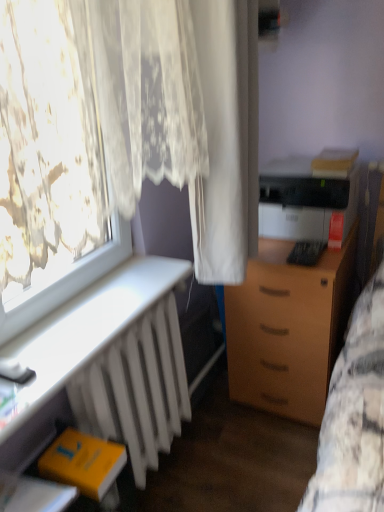
The width and height of the screenshot is (384, 512). What do you see at coordinates (106, 366) in the screenshot?
I see `white matte radiator at lower left` at bounding box center [106, 366].

In order to face white matte radiator at lower left, should I rotate leftwards or rightwards?

Turn left approximately 14.027 degrees to face it.

What do you see at coordinates (227, 140) in the screenshot? Image resolution: width=384 pixels, height=512 pixels. I see `white sheer curtain at center` at bounding box center [227, 140].

The image size is (384, 512). I want to click on white matte radiator at lower left, so click(x=106, y=366).

Considering the positions of objects yellow matte book at lower left and white sheer curtain at center in the image provided, who is in front, yellow matte book at lower left or white sheer curtain at center?

white sheer curtain at center is in front.

In the image, there is a yellow matte book at lower left. Where is `curtain above it (from the image's perspective)`? This screenshot has height=512, width=384. curtain above it (from the image's perspective) is located at coordinates (227, 140).

Can white sheer curtain at center be found inside yellow matte book at lower left?

Actually, white sheer curtain at center is outside yellow matte book at lower left.

From the image's perspective, between yellow matte book at lower left and white sheer curtain at center, who is located below?

yellow matte book at lower left, from the image's perspective.

Who is shorter, wooden drawer at center-right or yellow matte book at lower left?

Standing shorter between the two is yellow matte book at lower left.

Consider the image. Does wooden drawer at center-right have a greater width compared to yellow matte book at lower left?

Yes, wooden drawer at center-right is wider than yellow matte book at lower left.

Is wooden drawer at center-right behind white sheer curtain at center?

Yes, wooden drawer at center-right is further from the viewer.

Considering the sizes of objects wooden drawer at center-right and white sheer curtain at center in the image provided, who is wider, wooden drawer at center-right or white sheer curtain at center?

With larger width is wooden drawer at center-right.

The image size is (384, 512). I want to click on drawer located behind the white sheer curtain at center, so click(281, 339).

Considering the sizes of objects white sheer curtain at center and white matte radiator at lower left in the image provided, who is smaller, white sheer curtain at center or white matte radiator at lower left?

With smaller size is white matte radiator at lower left.

Would you say white sheer curtain at center is inside or outside white matte radiator at lower left?

white sheer curtain at center is located beyond the bounds of white matte radiator at lower left.

Considering the positions of objects white sheer curtain at center and white matte radiator at lower left in the image provided, who is more to the left, white sheer curtain at center or white matte radiator at lower left?

white matte radiator at lower left is more to the left.

Would you consider white sheer curtain at center to be distant from white matte radiator at lower left?

That's not correct — white sheer curtain at center is a little close to white matte radiator at lower left.

In the scene shown: Is yellow matte book at lower left looking in the opposite direction of wooden drawer at center-right?

yellow matte book at lower left is not turned away from wooden drawer at center-right.

From a real-world perspective, between yellow matte book at lower left and wooden drawer at center-right, who is vertically lower?

wooden drawer at center-right, from a real-world perspective.

Is yellow matte book at lower left with wooden drawer at center-right?

yellow matte book at lower left is not next to wooden drawer at center-right, and they're not touching.

Measure the distance between yellow matte book at lower left and wooden drawer at center-right.

The distance of yellow matte book at lower left from wooden drawer at center-right is 31.60 inches.

Which is correct: yellow matte book at lower left is inside white matte radiator at lower left, or outside of it?

The correct answer is: outside.

Is yellow matte book at lower left thinner than white matte radiator at lower left?

Yes, yellow matte book at lower left is thinner than white matte radiator at lower left.

Looking at this image, does yellow matte book at lower left have a larger size compared to white matte radiator at lower left?

No, yellow matte book at lower left is not bigger than white matte radiator at lower left.

Is yellow matte book at lower left directly adjacent to white matte radiator at lower left?

yellow matte book at lower left is not next to white matte radiator at lower left, and they're not touching.

Looking at this image, would you say white sheer curtain at center is outside wooden drawer at center-right?

Yes, white sheer curtain at center is located beyond the bounds of wooden drawer at center-right.

How many degrees apart are the facing directions of white sheer curtain at center and wooden drawer at center-right?

There is a 89.7-degree angle between the facing directions of white sheer curtain at center and wooden drawer at center-right.

Which is in front, point (256, 188) or point (314, 357)?

The point (256, 188) is in front.

Which of these two, white sheer curtain at center or wooden drawer at center-right, is wider?

wooden drawer at center-right is wider.

Find the location of a particular element. book on the left of white sheer curtain at center is located at coordinates (85, 465).

The image size is (384, 512). Find the location of `drawer that appears on the right of yellow matte book at lower left`. drawer that appears on the right of yellow matte book at lower left is located at coordinates (281, 339).

From the image, which object appears to be nearer to yellow matte book at lower left, white sheer curtain at center or wooden drawer at center-right?

white sheer curtain at center.

Estimate the real-world distances between objects in this image. Which object is further from white matte radiator at lower left, black plastic printer at right or yellow matte book at lower left?

Based on the image, black plastic printer at right appears to be further to white matte radiator at lower left.

Looking at the image, which one is located further to wooden drawer at center-right, white sheer curtain at center or white matte radiator at lower left?

Based on the image, white matte radiator at lower left appears to be further to wooden drawer at center-right.

From the image, which object appears to be nearer to white matte radiator at lower left, yellow matte book at lower left or white sheer curtain at center?

yellow matte book at lower left is closer to white matte radiator at lower left.

Based on their spatial positions, is wooden drawer at center-right or white matte radiator at lower left closer to white sheer curtain at center?

Based on the image, white matte radiator at lower left appears to be nearer to white sheer curtain at center.

Based on the photo, from the image, which object appears to be farther from yellow matte book at lower left, wooden drawer at center-right or white matte radiator at lower left?

wooden drawer at center-right.

From the image, which object appears to be nearer to white matte radiator at lower left, white sheer curtain at center or black plastic printer at right?

white sheer curtain at center lies closer to white matte radiator at lower left than the other object.

Looking at this image, from the image, which object appears to be nearer to white matte radiator at lower left, wooden drawer at center-right or black plastic printer at right?

The object closer to white matte radiator at lower left is wooden drawer at center-right.

Where is `book between white matte radiator at lower left and black plastic printer at right from left to right`? The width and height of the screenshot is (384, 512). book between white matte radiator at lower left and black plastic printer at right from left to right is located at coordinates pyautogui.click(x=85, y=465).

I want to click on curtain located between white matte radiator at lower left and black plastic printer at right in the left-right direction, so click(227, 140).

Identify the location of drawer between white sheer curtain at center and yellow matte book at lower left in the up-down direction. This screenshot has width=384, height=512. (x=281, y=339).

The width and height of the screenshot is (384, 512). I want to click on book situated between white matte radiator at lower left and wooden drawer at center-right from left to right, so click(85, 465).